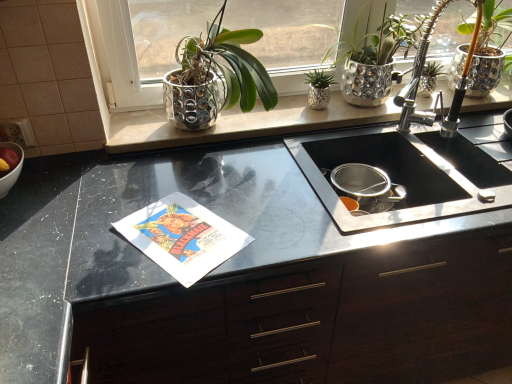
Question: Which is correct: satin nickel faucet at upper right is inside shiny metallic pot at upper right, which is the first houseplant in right-to-left order, or outside of it?

Choices:
 (A) inside
 (B) outside

Answer: (B)

Question: Considering their positions, is satin nickel faucet at upper right located in front of or behind shiny metallic pot at upper right, which ranks as the 3th houseplant in left-to-right order?

Choices:
 (A) behind
 (B) front

Answer: (B)

Question: Which of these objects is positioned farthest from the black matte cabinet at center?

Choices:
 (A) shiny metallic pot at upper center, which is the 3th houseplant in right-to-left order
 (B) white glossy bowl at left
 (C) satin nickel faucet at upper right
 (D) green metallic pot at upper center, which is counted as the second houseplant, starting from the left
 (E) shiny metallic pot at upper right, which ranks as the 3th houseplant in left-to-right order

Answer: (B)

Question: Which object is positioned closest to the shiny metallic pot at upper right, which ranks as the 3th houseplant in left-to-right order?

Choices:
 (A) green metallic pot at upper center, which is counted as the second houseplant, starting from the left
 (B) black matte cabinet at center
 (C) white glossy bowl at left
 (D) satin nickel faucet at upper right
 (E) shiny metallic pot at upper center, which is the 3th houseplant in right-to-left order

Answer: (D)